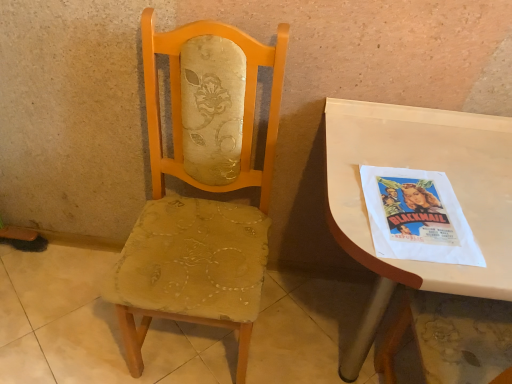
What do you see at coordinates (425, 169) in the screenshot? Image resolution: width=512 pixels, height=384 pixels. I see `white glossy desk at right` at bounding box center [425, 169].

The width and height of the screenshot is (512, 384). I want to click on white glossy desk at right, so 425,169.

The image size is (512, 384). In order to click on white glossy desk at right in this screenshot , I will do `click(425, 169)`.

Looking at this image, measure the distance between worn fabric chair at center and matte yellow fabric chair at center.

worn fabric chair at center and matte yellow fabric chair at center are 19.19 inches apart from each other.

Who is taller, worn fabric chair at center or matte yellow fabric chair at center?

matte yellow fabric chair at center.

Looking at this image, is worn fabric chair at center bigger than matte yellow fabric chair at center?

No, worn fabric chair at center is not bigger than matte yellow fabric chair at center.

How different are the orientations of worn fabric chair at center and matte yellow fabric chair at center in degrees?

The angle between the facing direction of worn fabric chair at center and the facing direction of matte yellow fabric chair at center is 86.6 degrees.

Consider the image. Would you say white paper poster at right is a long distance from matte yellow fabric chair at center?

No, white paper poster at right is in close proximity to matte yellow fabric chair at center.

Looking at the image, does white paper poster at right seem bigger or smaller compared to matte yellow fabric chair at center?

In the image, white paper poster at right appears to be smaller than matte yellow fabric chair at center.

From the picture: From a real-world perspective, which is physically above, white paper poster at right or matte yellow fabric chair at center?

white paper poster at right is physically above.

Based on the photo, from a real-world perspective, is worn fabric chair at center on white glossy desk at right?

No, from a real-world perspective, worn fabric chair at center is not above white glossy desk at right.

Can you confirm if worn fabric chair at center is positioned to the left of white glossy desk at right?

Yes, worn fabric chair at center is to the left of white glossy desk at right.

Based on the photo, is worn fabric chair at center turned away from white glossy desk at right?

No, worn fabric chair at center's orientation is not away from white glossy desk at right.

Find the location of a particular element. This screenshot has width=512, height=384. concrete on the left of white glossy desk at right is located at coordinates (91, 327).

From a real-world perspective, which is physically below, white glossy desk at right or matte yellow fabric chair at center?

In real-world perspective, white glossy desk at right is lower.

Is white glossy desk at right not near matte yellow fabric chair at center?

No, white glossy desk at right is not far from matte yellow fabric chair at center.

Is point (365, 353) in front of point (149, 9)?

No, (365, 353) is further to viewer.

Where is `chair located above the worn fabric chair at center (from a real-world perspective)`? This screenshot has height=384, width=512. chair located above the worn fabric chair at center (from a real-world perspective) is located at coordinates (201, 188).

From the picture: From the image's perspective, which one is positioned lower, matte yellow fabric chair at center or worn fabric chair at center?

worn fabric chair at center appears lower in the image.

Is matte yellow fabric chair at center not inside worn fabric chair at center?

Yes.

Can you confirm if matte yellow fabric chair at center is thinner than worn fabric chair at center?

Yes, matte yellow fabric chair at center is thinner than worn fabric chair at center.

Are worn fabric chair at center and white paper poster at right beside each other?

worn fabric chair at center and white paper poster at right are not in contact.

Does worn fabric chair at center lie in front of white paper poster at right?

No, it is not.

From a real-world perspective, which is physically above, worn fabric chair at center or white paper poster at right?

white paper poster at right is physically above.

From the image's perspective, between white glossy desk at right and white paper poster at right, who is located below?

white glossy desk at right is shown below in the image.

Are white glossy desk at right and white paper poster at right making contact?

Yes, white glossy desk at right is touching white paper poster at right.

Is white glossy desk at right positioned with its back to white paper poster at right?

That's not correct — white glossy desk at right is not looking away from white paper poster at right.

Locate an element on the screen. Image resolution: width=512 pixels, height=384 pixels. comic book that appears above the white glossy desk at right (from the image's perspective) is located at coordinates (417, 217).

In the image, there is a matte yellow fabric chair at center. Identify the location of concrete below it (from the image's perspective). (91, 327).

This screenshot has height=384, width=512. In order to click on chair that is under the white paper poster at right (from a real-world perspective) in this screenshot , I will do pyautogui.click(x=201, y=188).

When comparing their distances from matte yellow fabric chair at center, does worn fabric chair at center or white paper poster at right seem further?

Among the two, worn fabric chair at center is located further to matte yellow fabric chair at center.

Considering their positions, is white glossy desk at right positioned closer to white paper poster at right than worn fabric chair at center?

Based on the image, white glossy desk at right appears to be nearer to white paper poster at right.

Estimate the real-world distances between objects in this image. Which object is closer to white paper poster at right, worn fabric chair at center or white glossy desk at right?

white glossy desk at right is closer to white paper poster at right.

Looking at the image, which one is located further to matte yellow fabric chair at center, white glossy desk at right or white paper poster at right?

white paper poster at right is further to matte yellow fabric chair at center.

Looking at the image, which one is located further to worn fabric chair at center, white glossy desk at right or matte yellow fabric chair at center?

white glossy desk at right is positioned further to the anchor worn fabric chair at center.

Which object lies further to the anchor point worn fabric chair at center, white paper poster at right or matte yellow fabric chair at center?

The object further to worn fabric chair at center is white paper poster at right.

Based on their spatial positions, is white glossy desk at right or white paper poster at right further from worn fabric chair at center?

Based on the image, white paper poster at right appears to be further to worn fabric chair at center.

When comparing their distances from white glossy desk at right, does white paper poster at right or matte yellow fabric chair at center seem closer?

Among the two, white paper poster at right is located nearer to white glossy desk at right.

Find the location of a particular element. comic book between worn fabric chair at center and white glossy desk at right is located at coordinates (417, 217).

Find the location of `chair situated between worn fabric chair at center and white glossy desk at right from left to right`. chair situated between worn fabric chair at center and white glossy desk at right from left to right is located at coordinates (201, 188).

Find the location of a particular element. The width and height of the screenshot is (512, 384). chair located between worn fabric chair at center and white paper poster at right in the left-right direction is located at coordinates (201, 188).

This screenshot has width=512, height=384. In order to click on comic book situated between matte yellow fabric chair at center and white glossy desk at right from left to right in this screenshot , I will do `click(417, 217)`.